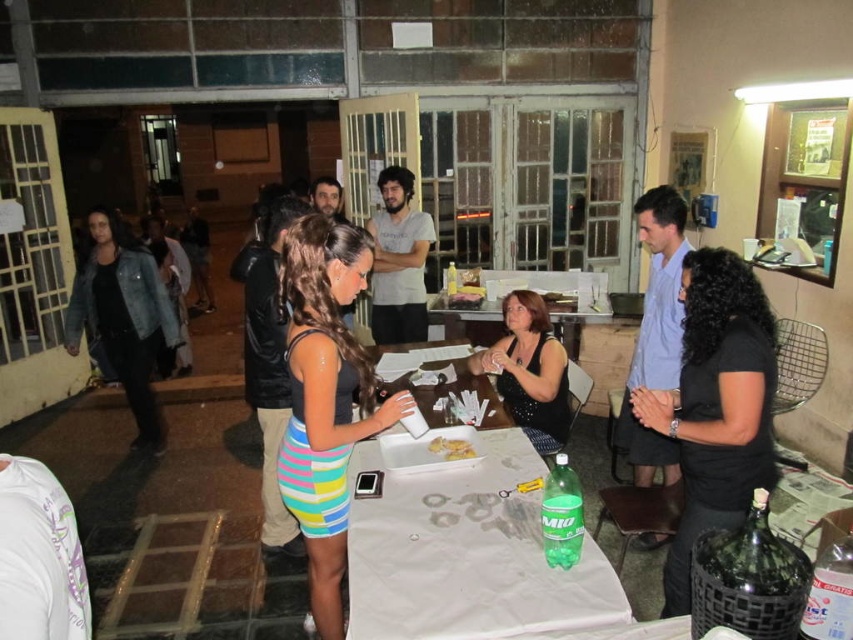
Who is more distant from viewer, [662,609] or [515,420]?

Positioned behind is point [515,420].

Is black matte shirt at center to the left of black sequined dress at center from the viewer's perspective?

In fact, black matte shirt at center is to the right of black sequined dress at center.

Who is more forward, [752,406] or [526,410]?

Point [752,406]

The height and width of the screenshot is (640, 853). I want to click on black matte shirt at center, so click(715, 404).

Is point (291, 412) positioned behind point (459, 458)?

That is True.

Is multicolored striped dress at center taller than yellow crumbly cake at center?

Yes.

Which is in front, point (289, 330) or point (473, 456)?

Point (289, 330) is in front.

Find the location of a particular element. The width and height of the screenshot is (853, 640). multicolored striped dress at center is located at coordinates [326, 397].

Based on the photo, how distant is denim jacket at left from black sequined dress at center?

7.63 feet

The image size is (853, 640). In order to click on denim jacket at left in this screenshot , I will do `click(123, 317)`.